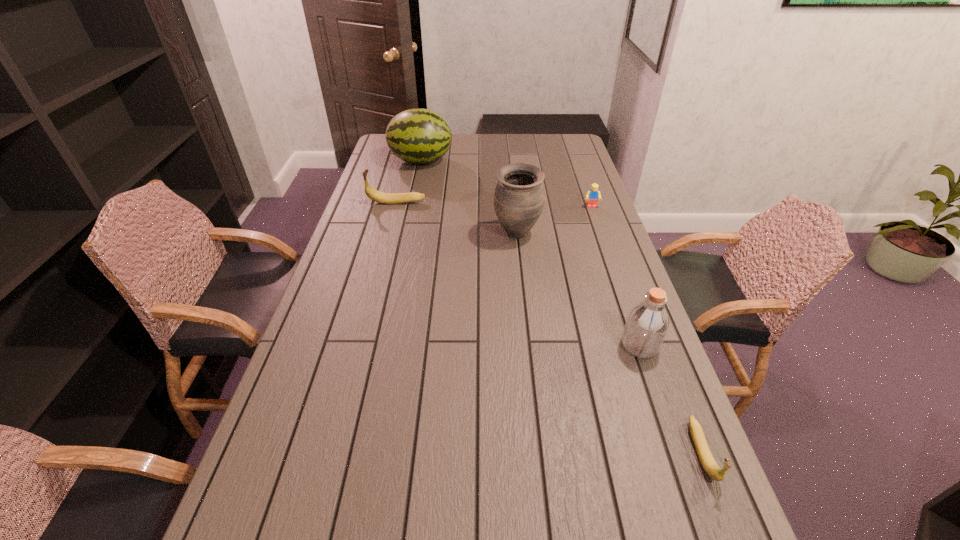
At what (x,y) coordinates should I click in order to perform the action: click on blank space that satisfies the following two spatial constraints: 1. at the stem end of the farthest object; 2. on the left side of the bottle. Please return your answer as a coordinate pair (x, y). This screenshot has width=960, height=540. Looking at the image, I should click on (381, 345).

Identify the location of free space that satisfies the following two spatial constraints: 1. at the stem end of the watermelon; 2. on the right side of the bottle. (381, 345).

Where is `vacant point that satisfies the following two spatial constraints: 1. at the stem end of the watermelon; 2. on the right side of the third nearest object`? This screenshot has width=960, height=540. vacant point that satisfies the following two spatial constraints: 1. at the stem end of the watermelon; 2. on the right side of the third nearest object is located at coordinates (405, 234).

This screenshot has height=540, width=960. Identify the location of vacant space that satisfies the following two spatial constraints: 1. at the stem end of the second nearest object; 2. on the right side of the farthest object. (381, 345).